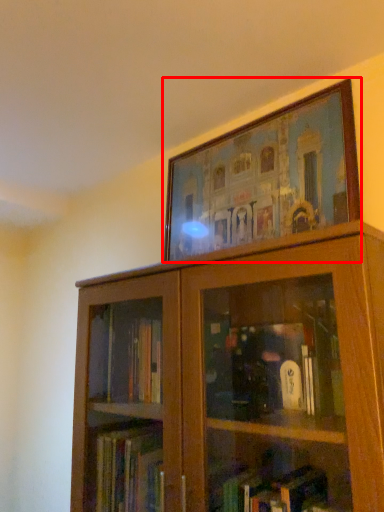
Question: Considering the relative positions of picture frame (annotated by the red box) and bookcase in the image provided, where is picture frame (annotated by the red box) located with respect to the staircase?

Choices:
 (A) right
 (B) left

Answer: (A)